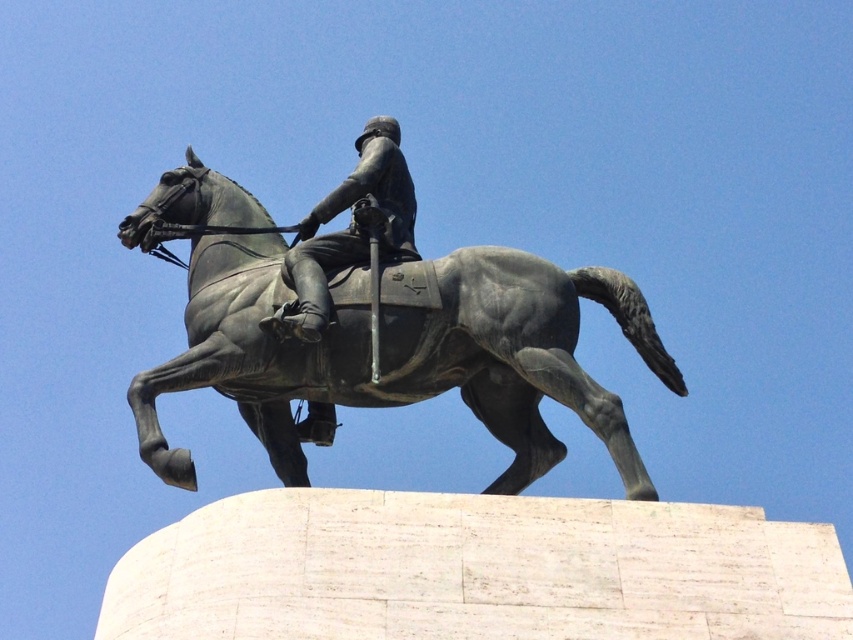
Based on the photo, you are a sculptor who wants to place a new plaque on the pedestal between the bronze statue at center and the polished bronze helmet at center. The plaque requires 3 meters of space. Is there enough space between them?

The bronze statue at center and polished bronze helmet at center are 4.29 meters apart from each other, so yes, there is enough space to place the plaque between them as 4.29 meters is greater than the required 3 meters.

You are an art student observing the bronze equestrian statue and its rider. You notice both the bronze statue at center and the polished bronze helmet at center. Which object is taller?

The bronze statue at center is taller than the polished bronze helmet at center.